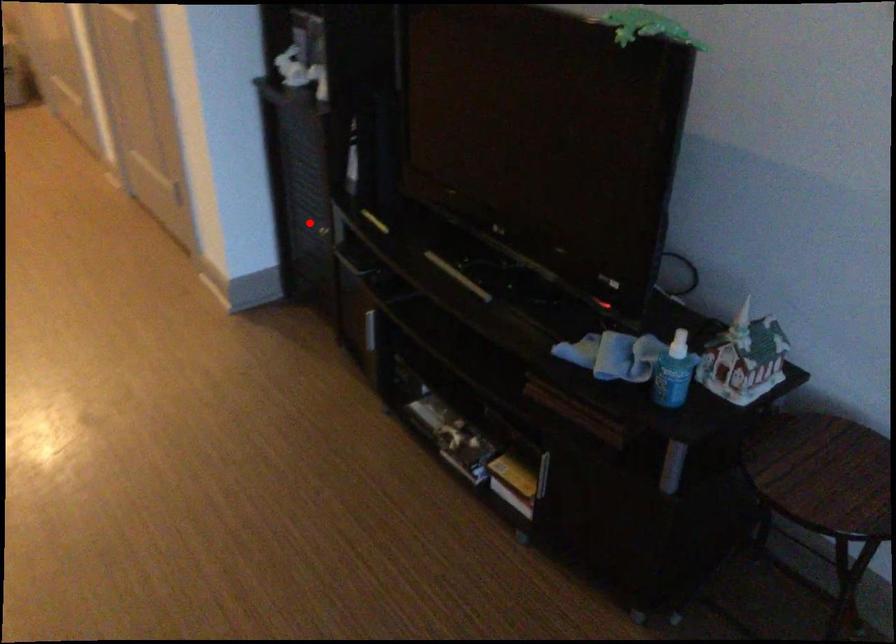
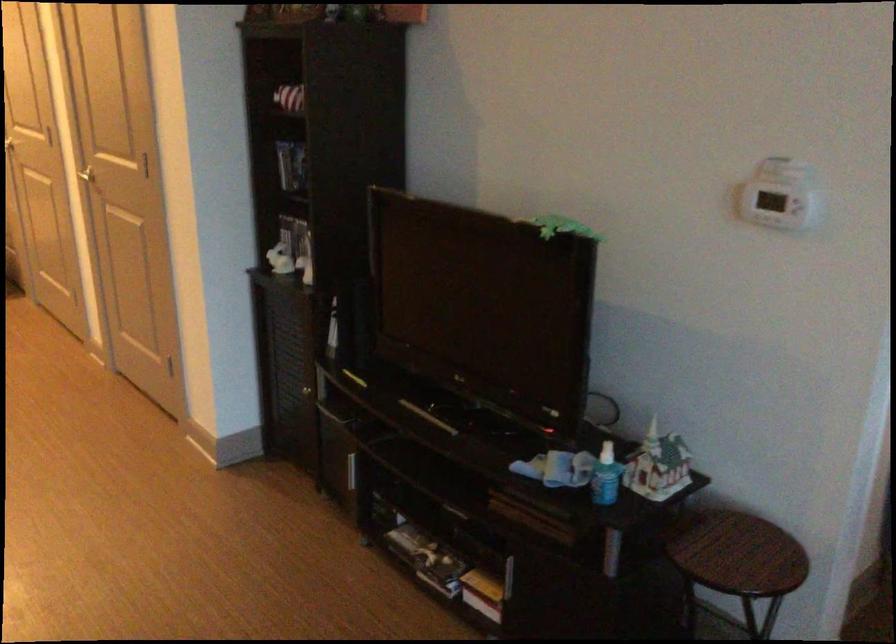
Question: I am providing you with two images of the same scene from different viewpoints. In image1, a red point is highlighted. Considering the same 3D point in image2, which of the following is correct?

Choices:
 (A) It is closer
 (B) It is farther

Answer: (B)